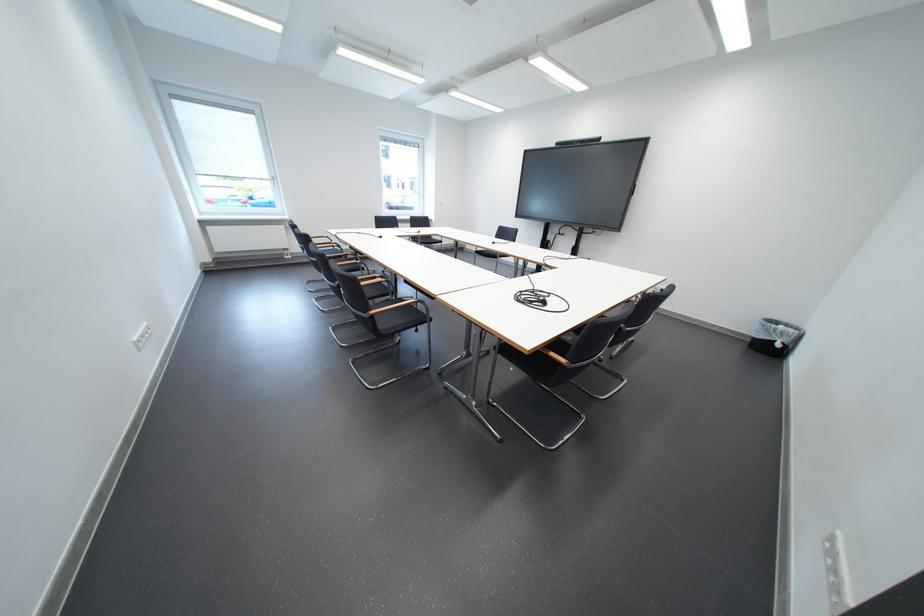
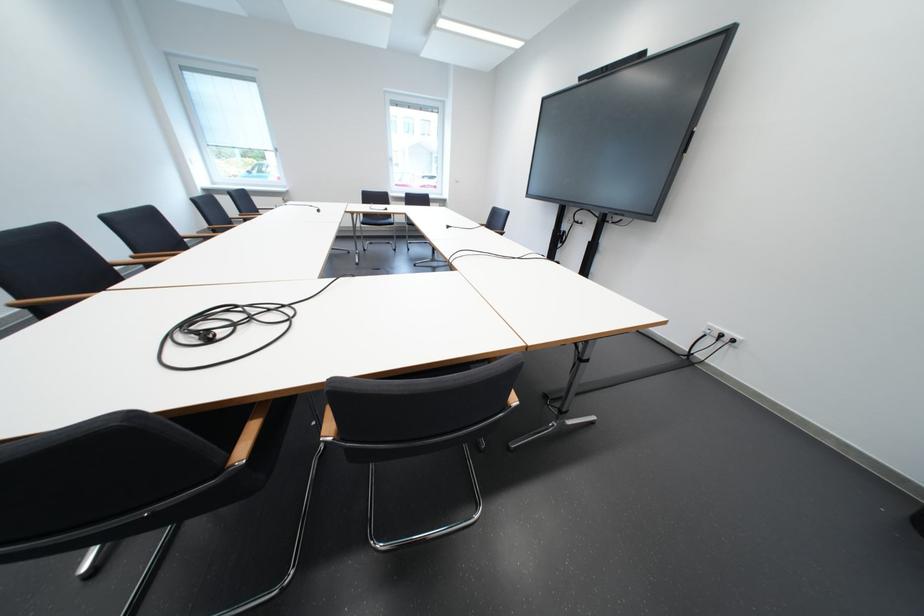
The images are taken continuously from a first-person perspective. In which direction are you moving?

The cameraman walked toward right, forward.